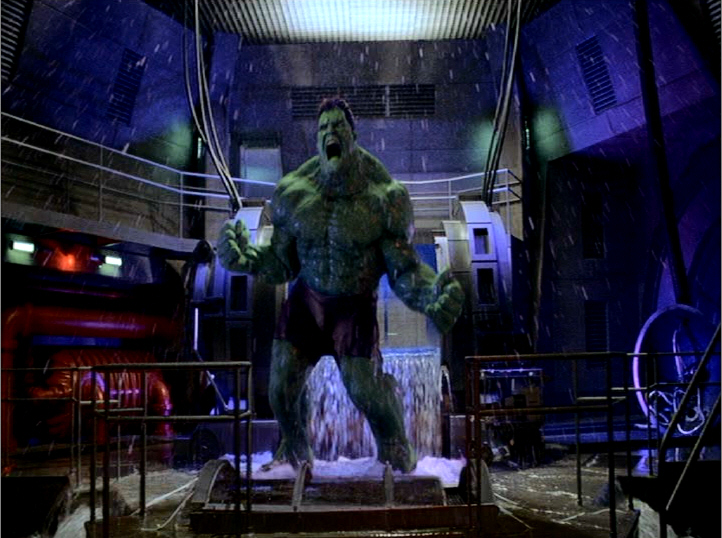
Identify the location of loft. (116, 173), (438, 186).